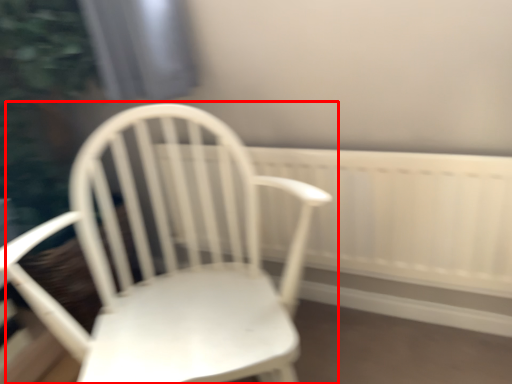
Question: In this image, where is chair (annotated by the red box) located relative to radiator?

Choices:
 (A) left
 (B) right

Answer: (A)